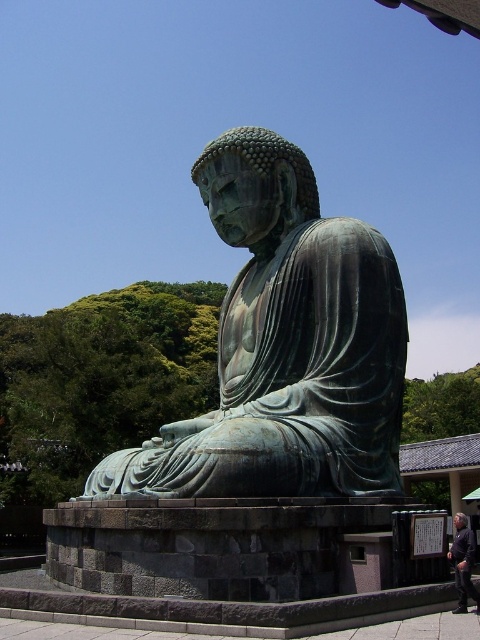
Does green patina statue at center appear on the right side of dark purple fabric at lower right?

In fact, green patina statue at center is to the left of dark purple fabric at lower right.

Does green patina statue at center appear under dark purple fabric at lower right?

Incorrect, green patina statue at center is not positioned below dark purple fabric at lower right.

Is point (265, 269) in front of point (460, 580)?

No, it is not.

At what (x,y) coordinates should I click in order to perform the action: click on green patina statue at center. Please return your answer as a coordinate pair (x, y). The height and width of the screenshot is (640, 480). Looking at the image, I should click on (286, 346).